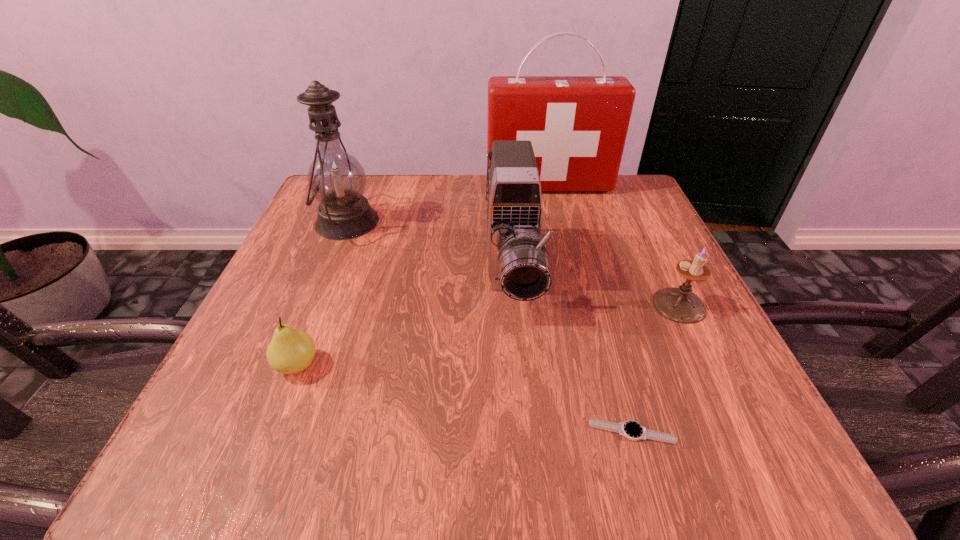
Locate an element on the screen. the first-aid kit is located at coordinates (577, 125).

Where is `oil lamp`? This screenshot has width=960, height=540. oil lamp is located at coordinates pos(336,179).

The image size is (960, 540). I want to click on the fourth shortest object, so click(x=519, y=265).

Image resolution: width=960 pixels, height=540 pixels. What are the coordinates of `candle holder` in the screenshot? It's located at (680, 305).

Image resolution: width=960 pixels, height=540 pixels. I want to click on the fifth tallest object, so click(x=290, y=351).

This screenshot has height=540, width=960. What are the coordinates of `the second nearest object` in the screenshot? It's located at (290, 351).

You are a GUI agent. You are given a task and a screenshot of the screen. Output one action in this format:
    pyautogui.click(x=<x>, y=<y>)
    Task: Click on the nearest object
    
    Given the screenshot: What is the action you would take?
    pyautogui.click(x=632, y=430)

Locate an element on the screen. The height and width of the screenshot is (540, 960). watch is located at coordinates (632, 430).

The width and height of the screenshot is (960, 540). In order to click on blank area located on the front face of the farthest object in this screenshot , I will do `click(573, 286)`.

What are the coordinates of `free spot located on the right of the oil lamp` in the screenshot? It's located at (516, 221).